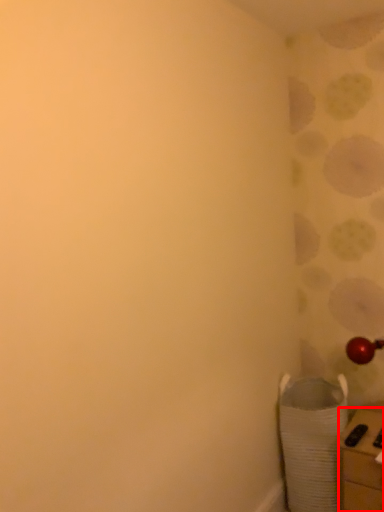
Question: Considering the relative positions of furniture (annotated by the red box) and laundry basket in the image provided, where is furniture (annotated by the red box) located with respect to the staircase?

Choices:
 (A) right
 (B) left

Answer: (A)